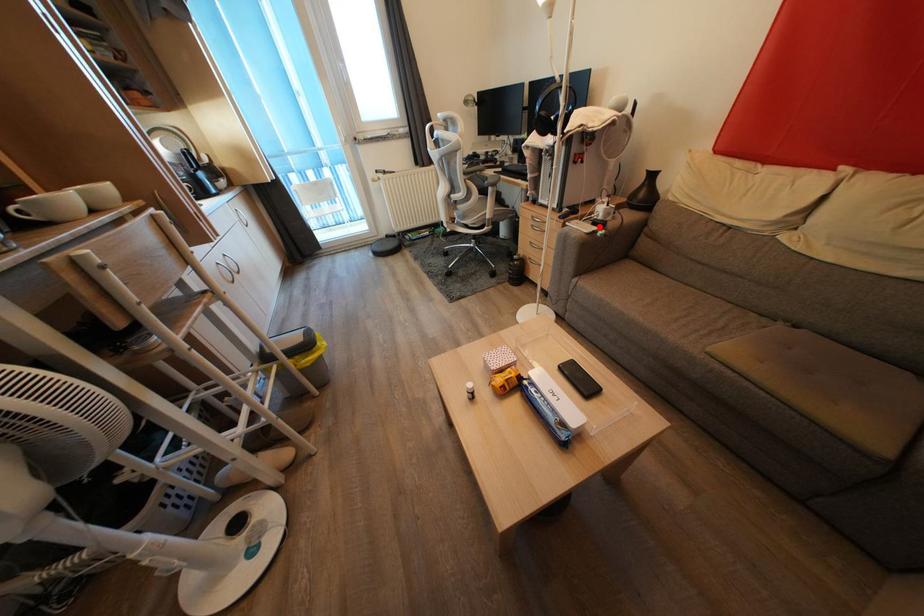
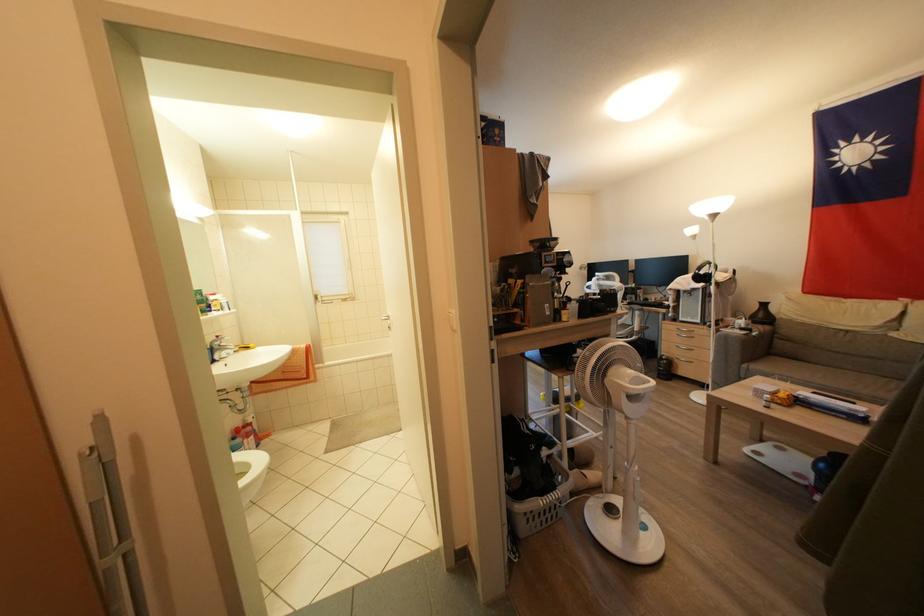
Where in the second image is the point corresponding to the highlighted location from the first image?

(747, 333)